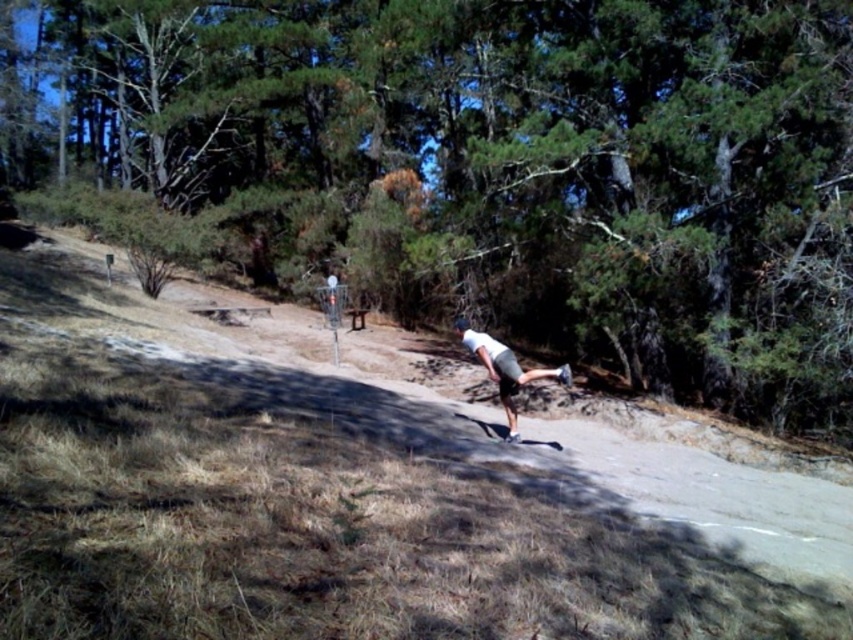
You are standing at the bottom of the slope and want to roll your white matte skateboard at center up to the green leafy tree at center. Considering the skateboard is light and the slope is steep, will it be easier to push the skateboard up the slope towards the tree or let it roll down on its own?

The green leafy tree at center is to the left of the white matte skateboard at center. Since the slope is steep, it would be easier to let the skateboard roll down towards the tree on its own rather than pushing it up against the slope.

You are a skateboarder trying to navigate through the park. You see a green leafy tree at center and a white matte skateboard at center. Which object is bigger in size?

The green leafy tree at center is larger in size than the white matte skateboard at center.